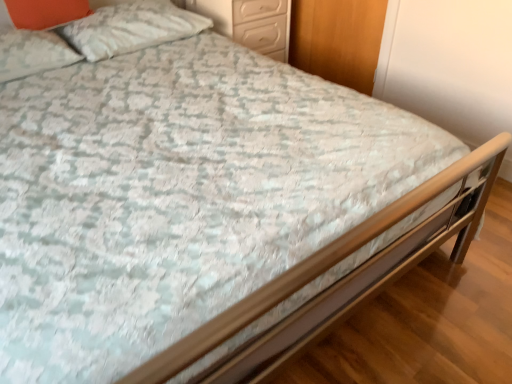
Question: Does orange matte pillow at upper left, which appears as the second pillow when viewed from the right, have a smaller size compared to white textured pillow at upper left, the 3th pillow viewed from the left?

Choices:
 (A) yes
 (B) no

Answer: (A)

Question: Could you tell me if orange matte pillow at upper left, which appears as the second pillow when viewed from the right, is facing white textured pillow at upper left, the 3th pillow viewed from the left?

Choices:
 (A) no
 (B) yes

Answer: (A)

Question: Considering the relative sizes of orange matte pillow at upper left, which is the 2th pillow in left-to-right order, and white textured pillow at upper left, the 3th pillow viewed from the left, in the image provided, is orange matte pillow at upper left, which is the 2th pillow in left-to-right order, bigger than white textured pillow at upper left, the 3th pillow viewed from the left,?

Choices:
 (A) yes
 (B) no

Answer: (B)

Question: Is orange matte pillow at upper left, which is the 2th pillow in left-to-right order, positioned far away from white textured pillow at upper left, the 3th pillow viewed from the left?

Choices:
 (A) no
 (B) yes

Answer: (A)

Question: Can you confirm if orange matte pillow at upper left, which is the 2th pillow in left-to-right order, is wider than white textured pillow at upper left, the 3th pillow viewed from the left?

Choices:
 (A) yes
 (B) no

Answer: (B)

Question: Considering the relative sizes of orange matte pillow at upper left, which appears as the second pillow when viewed from the right, and white textured pillow at upper left, the 3th pillow viewed from the left, in the image provided, is orange matte pillow at upper left, which appears as the second pillow when viewed from the right, thinner than white textured pillow at upper left, the 3th pillow viewed from the left,?

Choices:
 (A) no
 (B) yes

Answer: (B)

Question: Is orange matte pillow at upper left, which appears as the second pillow when viewed from the right, to the left of white glossy drawers at upper center from the viewer's perspective?

Choices:
 (A) yes
 (B) no

Answer: (A)

Question: Can you see orange matte pillow at upper left, which appears as the second pillow when viewed from the right, touching white glossy drawers at upper center?

Choices:
 (A) no
 (B) yes

Answer: (A)

Question: From a real-world perspective, is orange matte pillow at upper left, which is the 2th pillow in left-to-right order, positioned over white glossy drawers at upper center based on gravity?

Choices:
 (A) yes
 (B) no

Answer: (A)

Question: From the image's perspective, is orange matte pillow at upper left, which appears as the second pillow when viewed from the right, located above white glossy drawers at upper center?

Choices:
 (A) yes
 (B) no

Answer: (B)

Question: Is orange matte pillow at upper left, which appears as the second pillow when viewed from the right, at the right side of white glossy drawers at upper center?

Choices:
 (A) no
 (B) yes

Answer: (A)

Question: Does orange matte pillow at upper left, which appears as the second pillow when viewed from the right, have a lesser height compared to white glossy drawers at upper center?

Choices:
 (A) no
 (B) yes

Answer: (B)

Question: From a real-world perspective, is white textured pillow at upper left, the first pillow in the right-to-left sequence, located beneath orange matte pillow at upper left, which appears as the second pillow when viewed from the right?

Choices:
 (A) no
 (B) yes

Answer: (B)